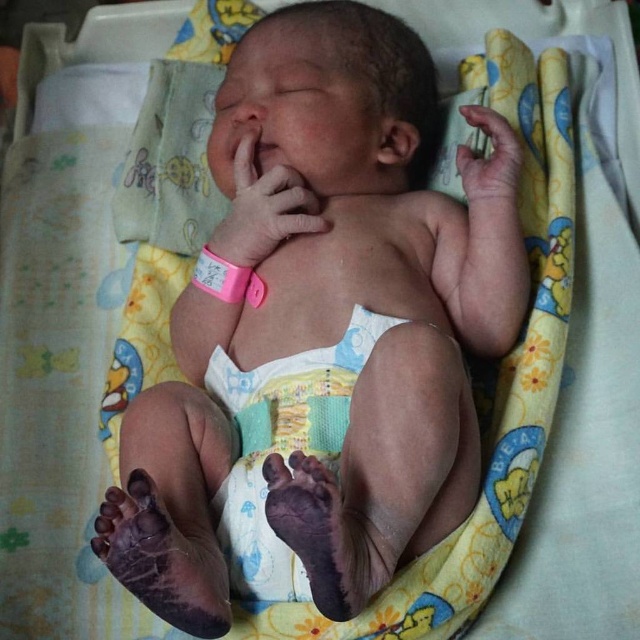
Question: Which point is farther from the camera taking this photo?

Choices:
 (A) (250, 138)
 (B) (248, 476)

Answer: (A)

Question: Does smooth white bib at center come in front of smooth skin hand at upper right?

Choices:
 (A) no
 (B) yes

Answer: (B)

Question: Estimate the real-world distances between objects in this image. Which object is closer to the pink rubber band at center?

Choices:
 (A) smooth white bib at center
 (B) smooth skin hand at upper right

Answer: (A)

Question: Which point is farther to the camera?

Choices:
 (A) (304, 198)
 (B) (513, 186)

Answer: (A)

Question: Observing the image, what is the correct spatial positioning of smooth white bib at center in reference to pink rubber band at center?

Choices:
 (A) left
 (B) right

Answer: (B)

Question: Does smooth white bib at center have a lesser width compared to pink rubber band at center?

Choices:
 (A) no
 (B) yes

Answer: (A)